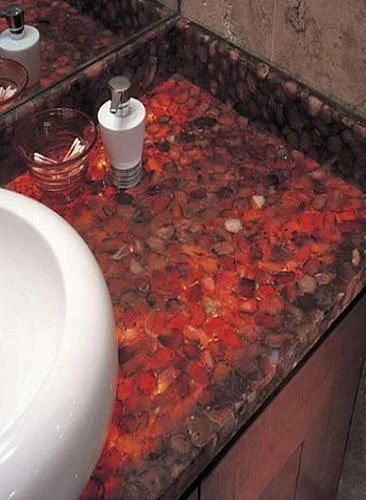
The height and width of the screenshot is (500, 366). Identify the location of cabinet. [288, 474].